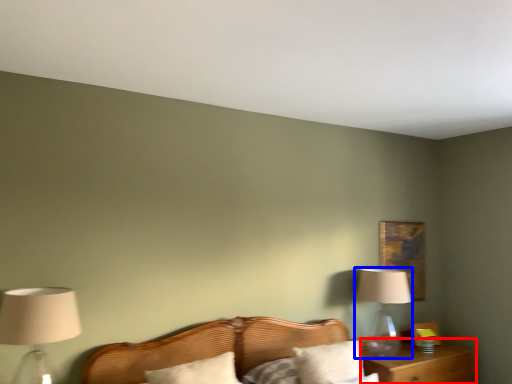
Question: Which point is closer to the camera, nightstand (highlighted by a red box) or table lamp (highlighted by a blue box)?

Choices:
 (A) nightstand
 (B) table lamp

Answer: (A)